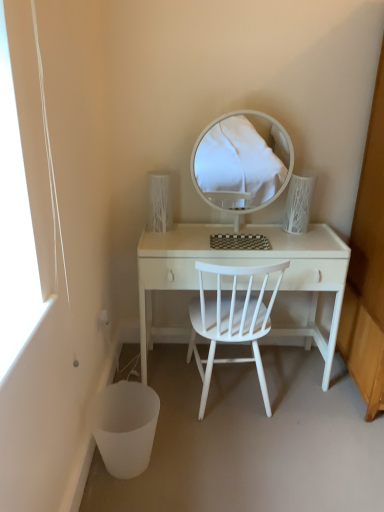
Question: Is white matte chair at center in front of or behind white wood desk at center in the image?

Choices:
 (A) behind
 (B) front

Answer: (B)

Question: From a real-world perspective, relative to white wood desk at center, is white matte chair at center vertically above or below?

Choices:
 (A) below
 (B) above

Answer: (B)

Question: Based on their relative distances, which object is farther from the white wood desk at center?

Choices:
 (A) white matte chair at center
 (B) white glossy mirror at center

Answer: (B)

Question: Which object is positioned farthest from the white wood desk at center?

Choices:
 (A) white matte chair at center
 (B) white glossy mirror at center

Answer: (B)